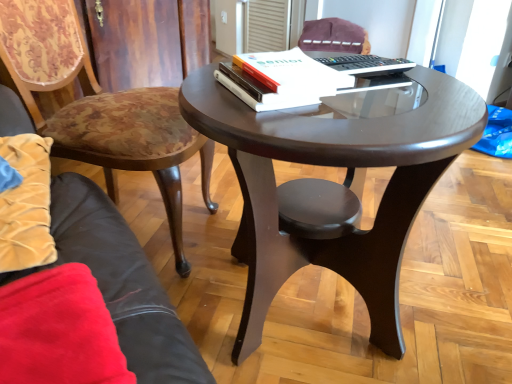
In order to click on vacant area that is situated to the right of white plastic remote control at upper center in this screenshot , I will do `click(430, 79)`.